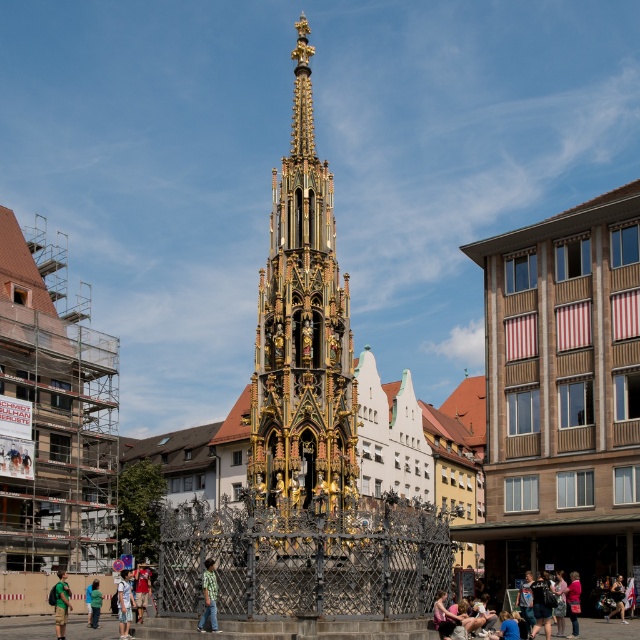
Question: Is matte black backpack at lower right to the right of blue fabric at lower center from the viewer's perspective?

Choices:
 (A) no
 (B) yes

Answer: (B)

Question: Which point is closer to the camera?

Choices:
 (A) click(296, 214)
 (B) click(145, 598)

Answer: (B)

Question: Which object appears farthest from the camera in this image?

Choices:
 (A) denim shorts at lower center
 (B) matte black backpack at lower right
 (C) green fabric shirt at lower left

Answer: (A)

Question: Does green fabric shirt at lower left appear over skinny jeans at lower right?

Choices:
 (A) no
 (B) yes

Answer: (A)

Question: Which object is positioned closest to the matte black backpack at lower right?

Choices:
 (A) green fabric shirt at lower left
 (B) blue fabric at lower center

Answer: (B)

Question: Does golden ornate church at center have a lesser width compared to matte black backpack at lower right?

Choices:
 (A) yes
 (B) no

Answer: (B)